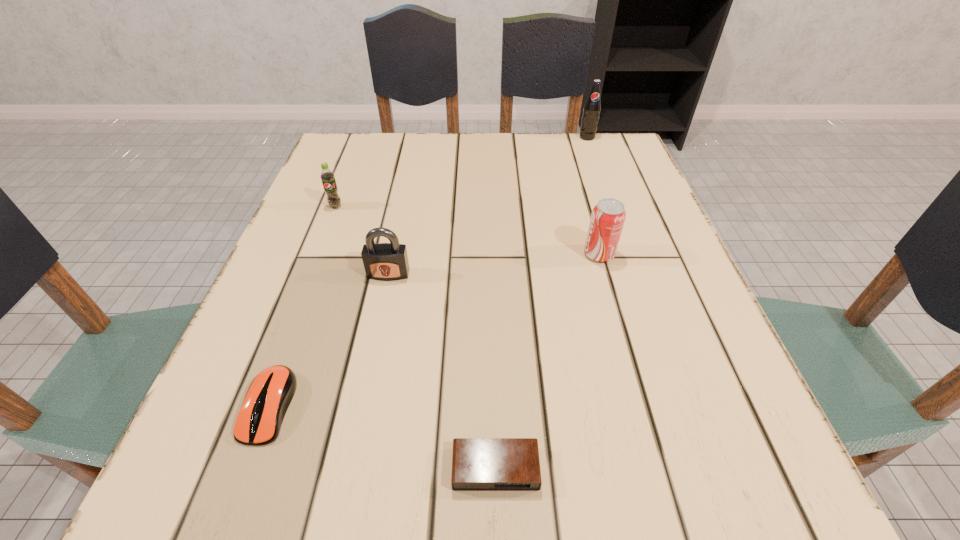
The image size is (960, 540). In order to click on alarm clock in this screenshot , I will do `click(478, 464)`.

What are the coordinates of `free space located on the front label of the rightmost soda` in the screenshot? It's located at (594, 157).

This screenshot has height=540, width=960. In order to click on free location located 0.080m on the logo side of the third farthest object in this screenshot , I will do `click(542, 254)`.

Identify the location of vacant space located on the logo side of the third farthest object. The width and height of the screenshot is (960, 540). (434, 254).

Image resolution: width=960 pixels, height=540 pixels. I want to click on vacant space located 0.360m on the logo side of the third farthest object, so click(397, 254).

Identify the location of free space located 0.320m on the front of the fourth farthest object near the keyhole. The height and width of the screenshot is (540, 960). (350, 457).

You are a GUI agent. You are given a task and a screenshot of the screen. Output one action in this format:
    pyautogui.click(x=<x>, y=<y>)
    Task: Click on the vacant space situated 0.120m on the front label of the leftmost soda
    Image resolution: width=960 pixels, height=540 pixels.
    Given the screenshot: What is the action you would take?
    pyautogui.click(x=320, y=247)

This screenshot has width=960, height=540. I want to click on vacant space situated on the right of the computer mouse, so coord(532,406).

In order to click on object at the far edge in this screenshot , I will do `click(592, 107)`.

Where is `object situated at the near edge`? This screenshot has width=960, height=540. object situated at the near edge is located at coordinates (478, 464).